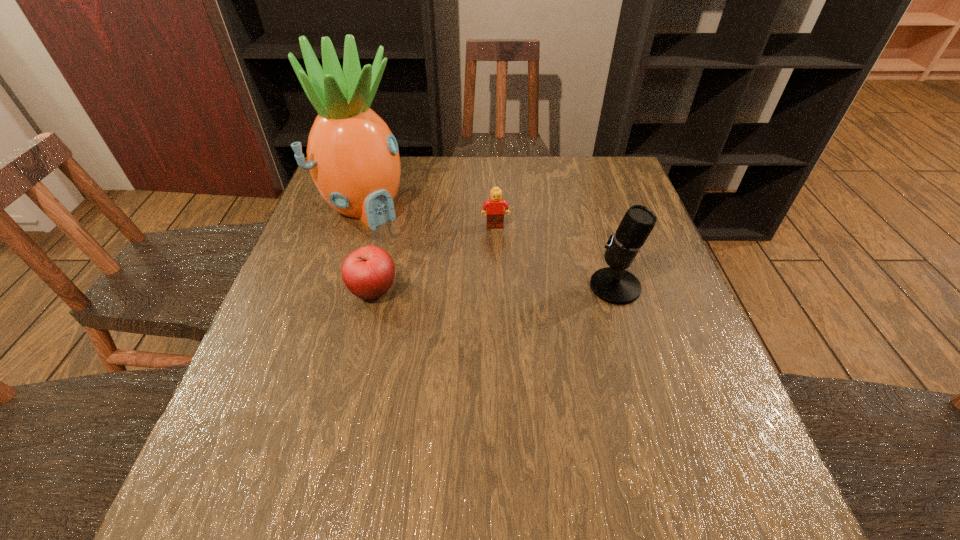
You are a GUI agent. You are given a task and a screenshot of the screen. Output one action in this format:
    pyautogui.click(x=<x>, y=<y>)
    Task: Click on the vacant position located on the face of the second object from right to left
    This screenshot has height=540, width=960.
    Given the screenshot: What is the action you would take?
    pos(506,327)

Find the location of a particular element. Image resolution: width=960 pixels, height=540 pixels. vacant space located 0.250m on the face of the second object from right to left is located at coordinates (503, 299).

The height and width of the screenshot is (540, 960). Find the location of `vacant area situated on the face of the second object from right to left`. vacant area situated on the face of the second object from right to left is located at coordinates (498, 252).

The width and height of the screenshot is (960, 540). Identify the location of object that is at the far edge. (353, 158).

Image resolution: width=960 pixels, height=540 pixels. Identify the location of apple at the left edge. (368, 272).

Where is `pineapple located at the left edge`? This screenshot has height=540, width=960. pineapple located at the left edge is located at coordinates (353, 158).

You are a GUI agent. You are given a task and a screenshot of the screen. Output one action in this format:
    pyautogui.click(x=<x>, y=<y>)
    Task: Click on the object that is at the right edge
    
    Given the screenshot: What is the action you would take?
    pyautogui.click(x=614, y=285)

Locate an element on the screen. The width and height of the screenshot is (960, 540). object that is positioned at the far left corner is located at coordinates (353, 158).

Where is `free space at the far edge`? free space at the far edge is located at coordinates (400, 195).

The image size is (960, 540). I want to click on blank space at the left edge of the desktop, so click(x=322, y=359).